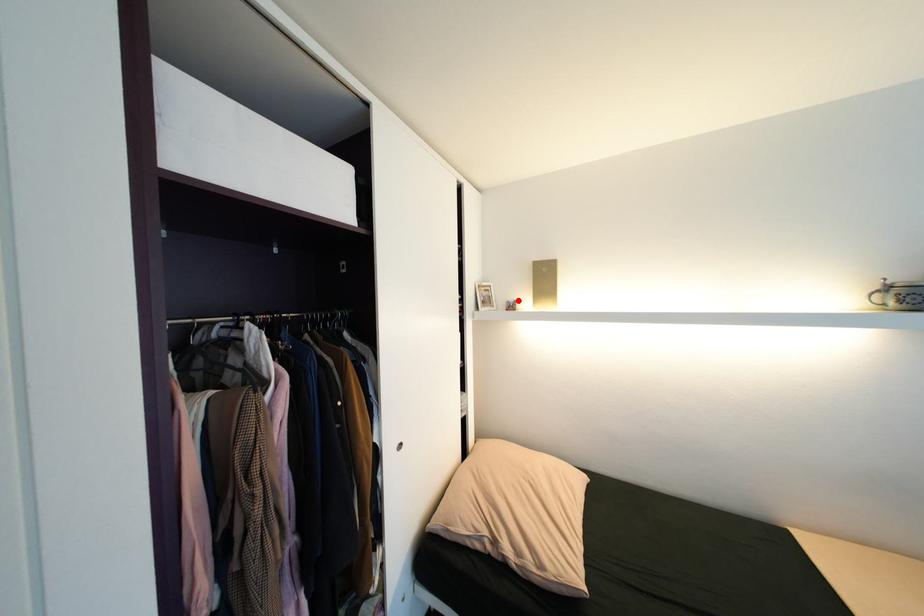
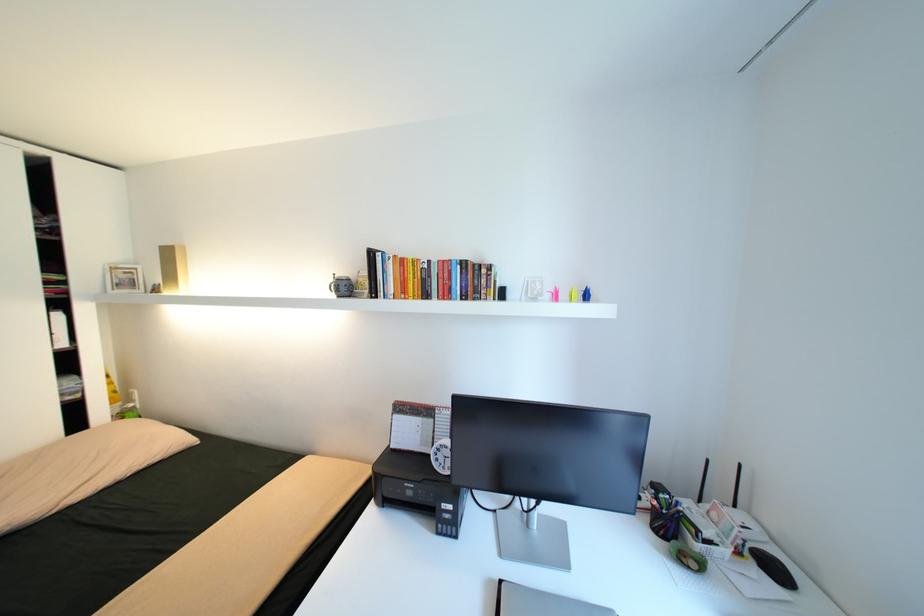
In the second image, find the point that corresponds to the highlighted location in the first image.

(164, 284)